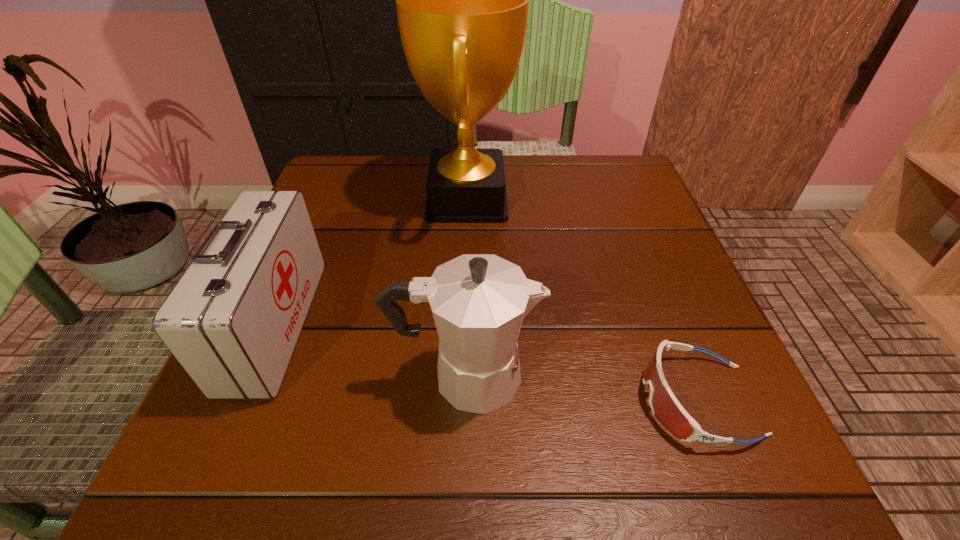
Locate an element on the screen. unoccupied position between the tallest object and the shortest object is located at coordinates (583, 300).

This screenshot has height=540, width=960. Identify the location of object that is the third closest to the rightmost object. point(232,321).

The image size is (960, 540). In order to click on object that is the third nearest to the award in this screenshot , I will do `click(665, 406)`.